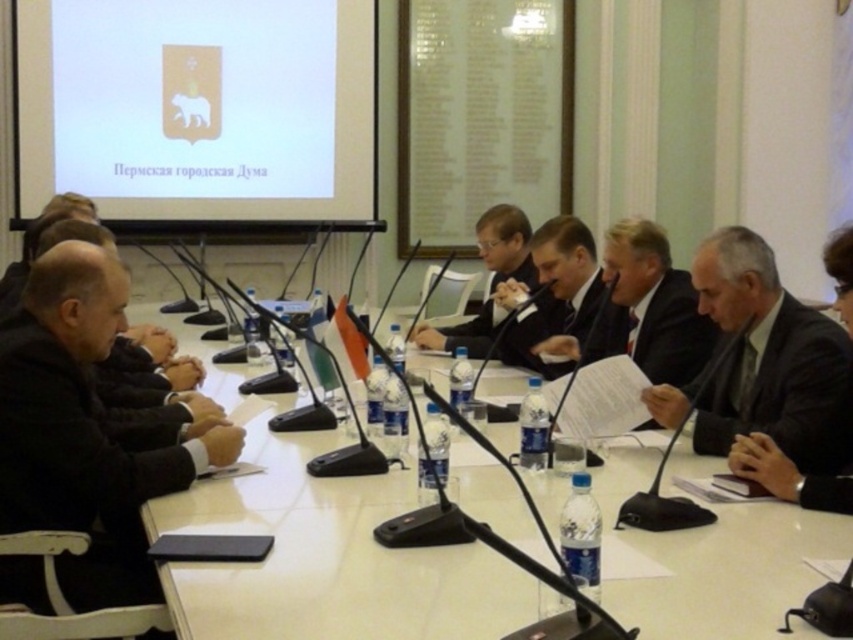
Does black suit at left appear on the left side of matte black suit at center?

Yes, black suit at left is to the left of matte black suit at center.

Who is lower down, black suit at left or matte black suit at center?

Positioned lower is black suit at left.

Locate an element on the screen. black suit at left is located at coordinates (86, 432).

Is white glossy table at center to the right of white glossy coat of arms at upper center from the viewer's perspective?

Correct, you'll find white glossy table at center to the right of white glossy coat of arms at upper center.

Does point (444, 614) come farther from viewer compared to point (169, 163)?

That is False.

Is point (331, 564) in front of point (363, 180)?

Yes.

In order to click on white glossy table at center in this screenshot , I will do `click(328, 557)`.

Who is shorter, white glossy coat of arms at upper center or black suit at left?

Standing shorter between the two is black suit at left.

Where is `white glossy coat of arms at upper center`? The height and width of the screenshot is (640, 853). white glossy coat of arms at upper center is located at coordinates (199, 108).